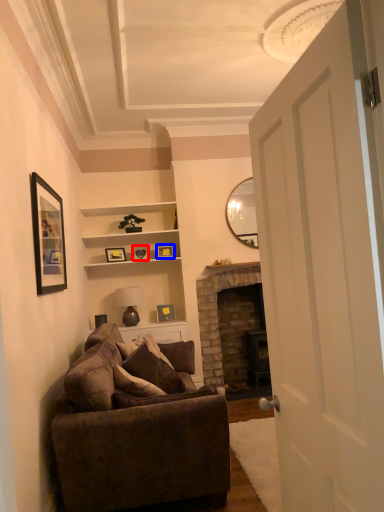
Question: Which of the following is the closest to the observer, picture frame (highlighted by a red box) or picture frame (highlighted by a blue box)?

Choices:
 (A) picture frame
 (B) picture frame

Answer: (A)